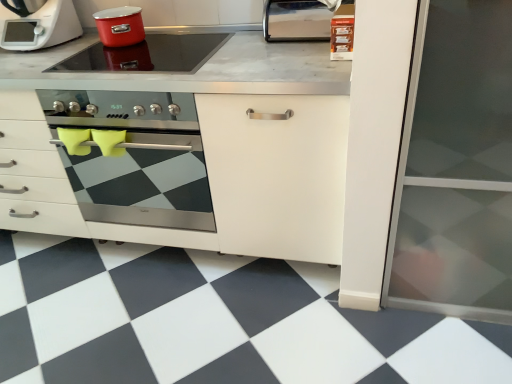
Question: Visually, is matte red pot at upper center, which is the 1th kitchen appliance from top to bottom, positioned to the left or to the right of smooth glass cooktop at upper center, which is the first kitchen appliance in bottom-to-top order?

Choices:
 (A) right
 (B) left

Answer: (B)

Question: In terms of height, does matte red pot at upper center, the second kitchen appliance positioned from the bottom, look taller or shorter compared to smooth glass cooktop at upper center, which is the first kitchen appliance in bottom-to-top order?

Choices:
 (A) tall
 (B) short

Answer: (A)

Question: Based on their relative distances, which object is farther from the white matte food processor at upper left?

Choices:
 (A) smooth glass cooktop at upper center, the 2th kitchen appliance positioned from the top
 (B) white matte cabinet at center
 (C) satin silver paper towel dispenser at upper right
 (D) matte red pot at upper center, which is the 1th kitchen appliance from top to bottom
 (E) stainless steel oven at center

Answer: (C)

Question: Based on their relative distances, which object is nearer to the white matte cabinet at center?

Choices:
 (A) smooth glass cooktop at upper center, the 2th kitchen appliance positioned from the top
 (B) satin silver paper towel dispenser at upper right
 (C) black/white checkered tile at lower center
 (D) stainless steel oven at center
 (E) white matte food processor at upper left

Answer: (D)